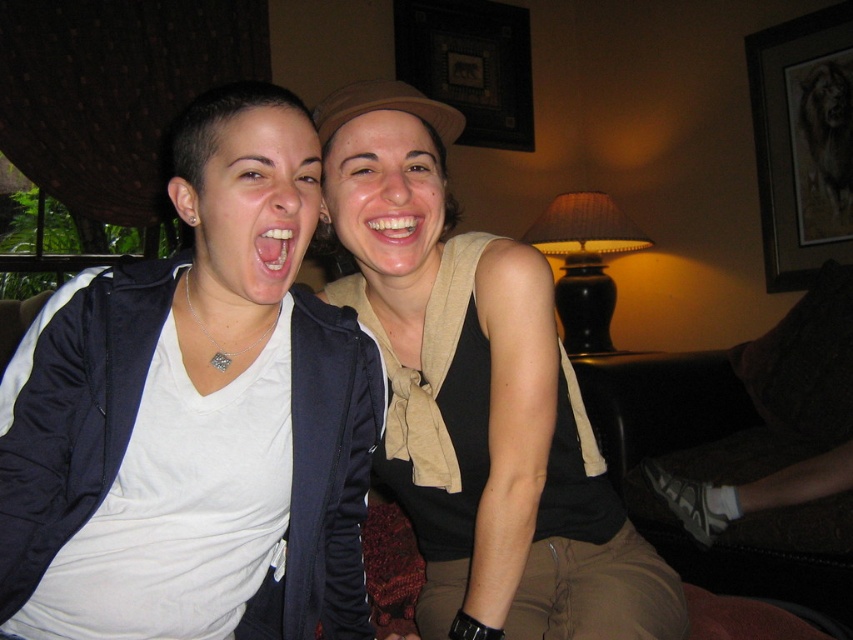
You are a photographer trying to focus on the white matte shirt at center and the white glossy teeth at center. Which object should you adjust your camera focus on first if you want to ensure both are in focus?

The white matte shirt at center is in front of the white glossy teeth at center, so you should focus on the white glossy teeth at center first to ensure both are in focus.

You are standing at the point labeled point (270, 241) in a living room. You want to move to the point labeled point (618, 627). Which direction should you move in to reach your destination?

To reach point (618, 627) from point (270, 241), you should move backward since point (618, 627) is behind point (270, 241).

You are standing in the living room and want to take a photo of the point at coordinates (x=548, y=410). The camera you are using has a minimum focus distance of 3 feet. Will the point be in focus?

The point at coordinates (x=548, y=410) is 3.36 feet from the camera, which is beyond the minimum focus distance of 3 feet. Therefore, the point will be in focus.